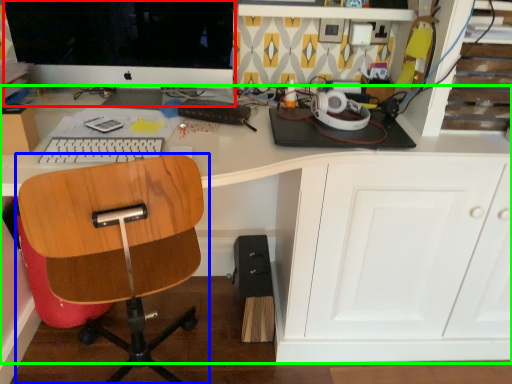
Question: Estimate the real-world distances between objects in this image. Which object is closer to computer monitor (highlighted by a red box), chair (highlighted by a blue box) or desk (highlighted by a green box)?

Choices:
 (A) chair
 (B) desk

Answer: (B)